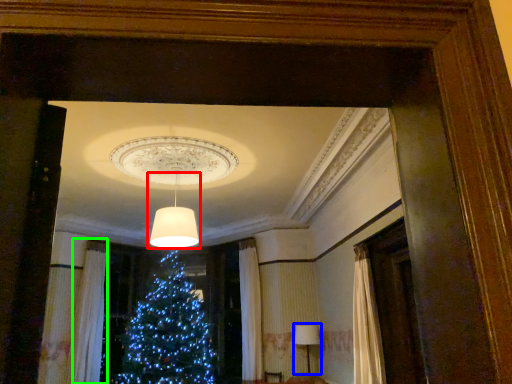
Question: Considering the real-world distances, which object is closest to lamp (highlighted by a red box)? lamp (highlighted by a blue box) or curtain (highlighted by a green box).

Choices:
 (A) lamp
 (B) curtain

Answer: (A)